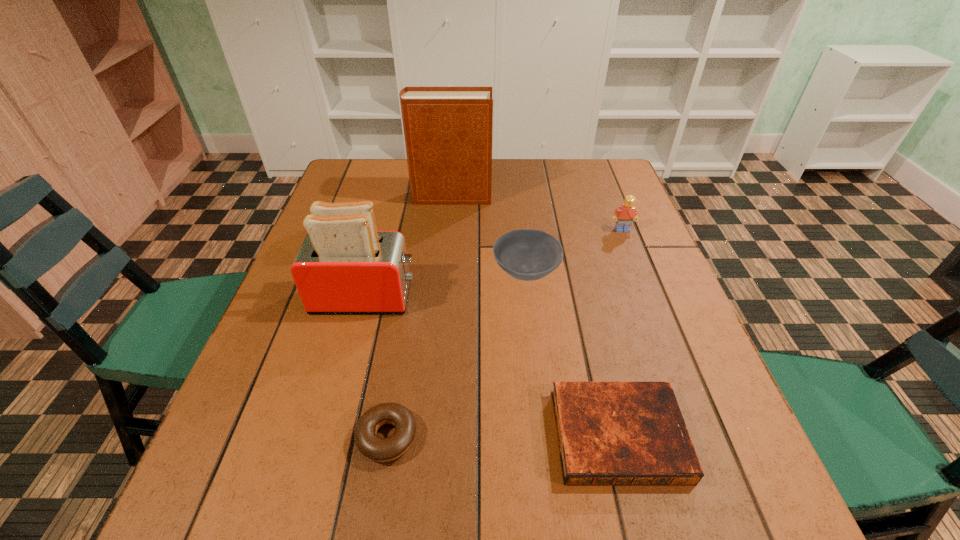
You are a GUI agent. You are given a task and a screenshot of the screen. Output one action in this format:
    pyautogui.click(x=<x>, y=<y>)
    Task: Click on the vacant region located 0.120m on the front-facing side of the rightmost object
    Image resolution: width=960 pixels, height=540 pixels.
    Given the screenshot: What is the action you would take?
    pyautogui.click(x=635, y=262)

In order to click on vacant space situated on the left of the fourth tallest object in this screenshot , I will do `click(427, 273)`.

This screenshot has width=960, height=540. I want to click on free space located 0.210m on the left of the doughnut, so click(x=236, y=437).

This screenshot has height=540, width=960. I want to click on free space located 0.070m on the spine side of the Bible, so click(642, 535).

Find the location of `object present at the far edge`. object present at the far edge is located at coordinates (448, 130).

Find the location of a particular element. Image resolution: width=960 pixels, height=540 pixels. object present at the near edge is located at coordinates (609, 433).

This screenshot has height=540, width=960. Find the location of `object at the left edge`. object at the left edge is located at coordinates (344, 265).

This screenshot has height=540, width=960. I want to click on Lego that is at the right edge, so click(627, 212).

I want to click on Bible positioned at the right edge, so click(609, 433).

Locate an element on the screen. object at the near right corner is located at coordinates (609, 433).